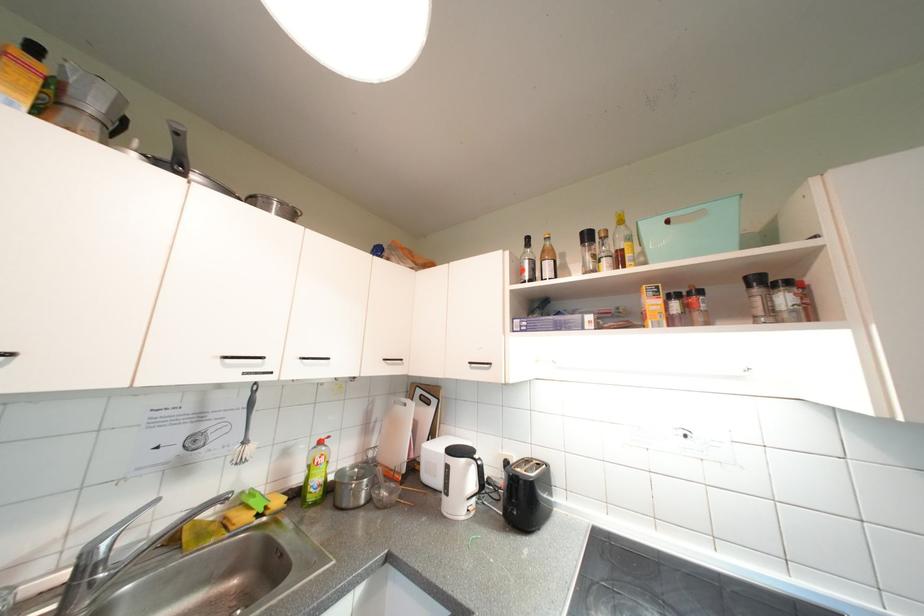
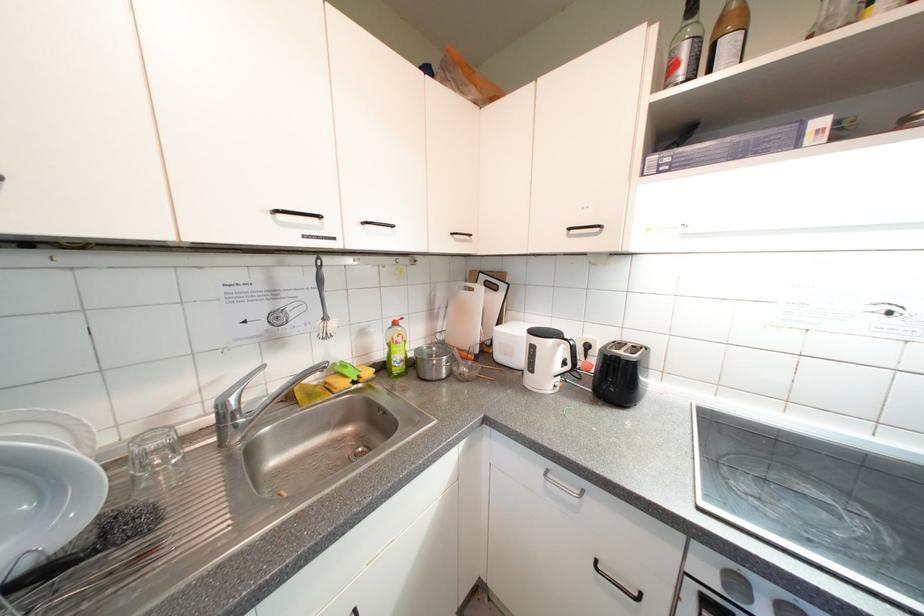
Find the pixel in the second image that matches the point at 552,254 in the first image.

(728, 23)